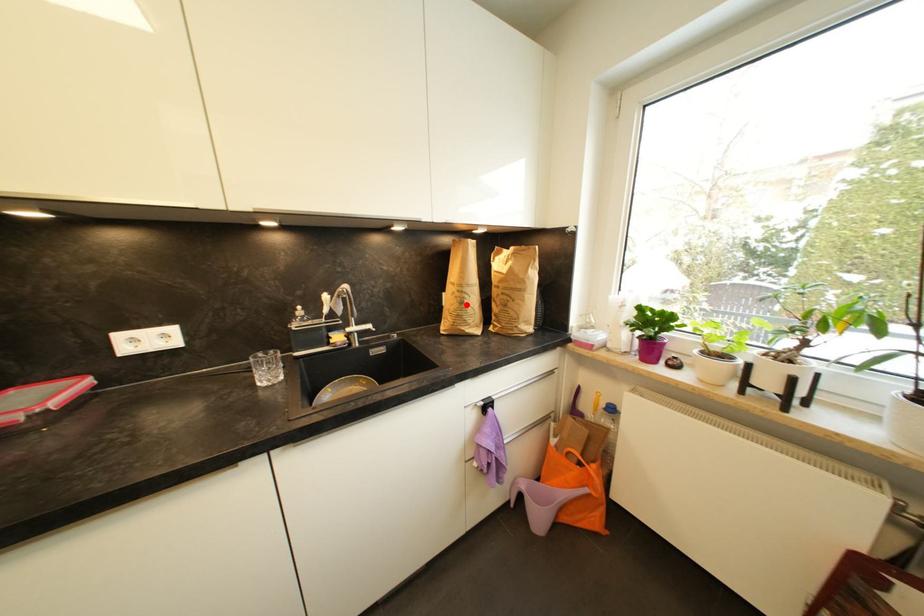
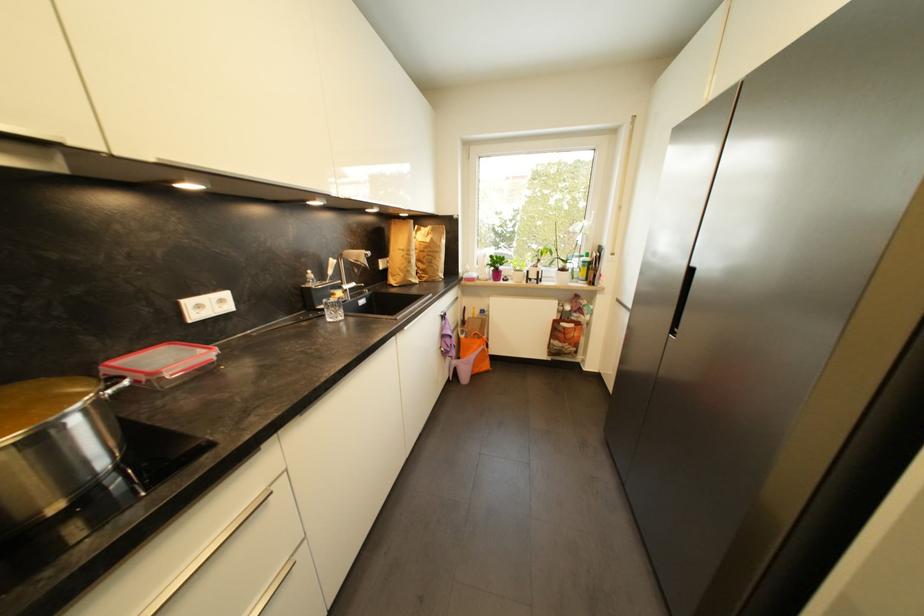
Question: I am providing you with two images of the same scene from different viewpoints. A red point is shown in image1. For the corresponding object point in image2, is it positioned nearer or farther from the camera?

Choices:
 (A) Nearer
 (B) Farther

Answer: (A)